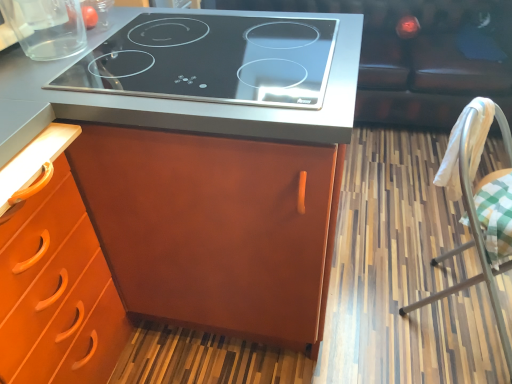
What do you see at coordinates (179, 100) in the screenshot? I see `black glass cooktop at upper center` at bounding box center [179, 100].

Describe the element at coordinates (165, 212) in the screenshot. I see `matte wood cabinet at center` at that location.

You are a GUI agent. You are given a task and a screenshot of the screen. Output one action in this format:
    pyautogui.click(x=<x>, y=<y>)
    Task: Click on the white fabric-covered chair at right
    
    Given the screenshot: What is the action you would take?
    pyautogui.click(x=475, y=211)

You are a GUI agent. You are given a task and a screenshot of the screen. Output one action in this format:
    pyautogui.click(x=<x>, y=<y>)
    Task: Click on the transparent glass container at upper left
    The height and width of the screenshot is (384, 512).
    Given the screenshot: What is the action you would take?
    pyautogui.click(x=46, y=27)

Is leather couch at upper right positioned with its back to transparent glass container at upper left?

That's not correct — leather couch at upper right is not looking away from transparent glass container at upper left.

Can you confirm if leather couch at upper right is bigger than transparent glass container at upper left?

Correct, leather couch at upper right is larger in size than transparent glass container at upper left.

Which of these two, leather couch at upper right or transparent glass container at upper left, is wider?

leather couch at upper right.

From a real-world perspective, is leather couch at upper right physically above transparent glass container at upper left?

No, from a real-world perspective, leather couch at upper right is not on top of transparent glass container at upper left.

Is white fabric-covered chair at right with matte wood cabinet at center?

No.

In the scene shown: Does white fabric-covered chair at right turn towards matte wood cabinet at center?

No, white fabric-covered chair at right does not turn towards matte wood cabinet at center.

Considering the relative sizes of white fabric-covered chair at right and matte wood cabinet at center in the image provided, is white fabric-covered chair at right bigger than matte wood cabinet at center?

No, white fabric-covered chair at right is not bigger than matte wood cabinet at center.

From a real-world perspective, is white fabric-covered chair at right located higher than matte wood cabinet at center?

Actually, white fabric-covered chair at right is physically below matte wood cabinet at center in the real world.

Which of these two, transparent glass container at upper left or black glass cooktop at upper center, stands shorter?

black glass cooktop at upper center is shorter.

Is transparent glass container at upper left in contact with black glass cooktop at upper center?

There is a gap between transparent glass container at upper left and black glass cooktop at upper center.

Is transparent glass container at upper left bigger or smaller than black glass cooktop at upper center?

transparent glass container at upper left is smaller than black glass cooktop at upper center.

Based on the photo, in the image, is matte wood cabinet at center on the left side or the right side of transparent glass container at upper left?

matte wood cabinet at center is to the right of transparent glass container at upper left.

From a real-world perspective, is matte wood cabinet at center on transparent glass container at upper left?

No, from a real-world perspective, matte wood cabinet at center is not on top of transparent glass container at upper left.

From the image's perspective, relative to transparent glass container at upper left, is matte wood cabinet at center above or below?

From the image's perspective, matte wood cabinet at center appears below transparent glass container at upper left.

How different are the orientations of matte wood cabinet at center and transparent glass container at upper left in degrees?

The facing directions of matte wood cabinet at center and transparent glass container at upper left are 89.4 degrees apart.

Is point (508, 341) positioned after point (447, 103)?

No, (508, 341) is closer to viewer.

In terms of size, does white fabric-covered chair at right appear bigger or smaller than leather couch at upper right?

white fabric-covered chair at right is smaller than leather couch at upper right.

Considering the sizes of objects white fabric-covered chair at right and leather couch at upper right in the image provided, who is wider, white fabric-covered chair at right or leather couch at upper right?

leather couch at upper right is wider.

Does point (207, 121) lie in front of point (73, 22)?

Yes, point (207, 121) is closer to viewer.

Is black glass cooktop at upper center inside the boundaries of transparent glass container at upper left, or outside?

black glass cooktop at upper center cannot be found inside transparent glass container at upper left.

Considering the sizes of objects black glass cooktop at upper center and transparent glass container at upper left in the image provided, who is shorter, black glass cooktop at upper center or transparent glass container at upper left?

Standing shorter between the two is black glass cooktop at upper center.

From the image's perspective, would you say black glass cooktop at upper center is shown under transparent glass container at upper left?

Yes.

In the scene shown: From the image's perspective, is black glass cooktop at upper center beneath matte wood cabinet at center?

Actually, black glass cooktop at upper center appears above matte wood cabinet at center in the image.

Would you say black glass cooktop at upper center is a long distance from matte wood cabinet at center?

That's not correct — black glass cooktop at upper center is a little close to matte wood cabinet at center.

Is matte wood cabinet at center at the back of black glass cooktop at upper center?

Yes, black glass cooktop at upper center's orientation is away from matte wood cabinet at center.

Can you confirm if black glass cooktop at upper center is wider than matte wood cabinet at center?

Incorrect, the width of black glass cooktop at upper center does not surpass that of matte wood cabinet at center.

You are a GUI agent. You are given a task and a screenshot of the screen. Output one action in this format:
    pyautogui.click(x=<x>, y=<y>)
    Task: Click on the couch lying on the right of transparent glass container at upper left
    
    Given the screenshot: What is the action you would take?
    pyautogui.click(x=419, y=56)

You are a GUI agent. You are given a task and a screenshot of the screen. Output one action in this format:
    pyautogui.click(x=<x>, y=<y>)
    Task: Click on the chair behind the matte wood cabinet at center
    
    Given the screenshot: What is the action you would take?
    pyautogui.click(x=475, y=211)

Which object lies nearer to the anchor point matte wood cabinet at center, transparent glass container at upper left or black glass cooktop at upper center?

The object closer to matte wood cabinet at center is black glass cooktop at upper center.

Considering their positions, is white fabric-covered chair at right positioned further to leather couch at upper right than transparent glass container at upper left?

transparent glass container at upper left lies further to leather couch at upper right than the other object.

Based on their spatial positions, is matte wood cabinet at center or transparent glass container at upper left further from white fabric-covered chair at right?

Among the two, transparent glass container at upper left is located further to white fabric-covered chair at right.

From the image, which object appears to be farther from black glass cooktop at upper center, transparent glass container at upper left or leather couch at upper right?

leather couch at upper right is positioned further to the anchor black glass cooktop at upper center.

Based on the photo, estimate the real-world distances between objects in this image. Which object is closer to black glass cooktop at upper center, transparent glass container at upper left or matte wood cabinet at center?

transparent glass container at upper left lies closer to black glass cooktop at upper center than the other object.

Which object lies further to the anchor point matte wood cabinet at center, white fabric-covered chair at right or transparent glass container at upper left?

white fabric-covered chair at right is further to matte wood cabinet at center.

Which object lies further to the anchor point transparent glass container at upper left, white fabric-covered chair at right or black glass cooktop at upper center?

Based on the image, white fabric-covered chair at right appears to be further to transparent glass container at upper left.

Estimate the real-world distances between objects in this image. Which object is further from black glass cooktop at upper center, leather couch at upper right or matte wood cabinet at center?

leather couch at upper right is further to black glass cooktop at upper center.

What are the coordinates of `countertop between transparent glass container at upper left and matte wood cabinet at center in the vertical direction` in the screenshot? It's located at click(x=179, y=100).

Where is `chair located between matte wood cabinet at center and leather couch at upper right in the depth direction`? The height and width of the screenshot is (384, 512). chair located between matte wood cabinet at center and leather couch at upper right in the depth direction is located at coordinates (475, 211).

You are a GUI agent. You are given a task and a screenshot of the screen. Output one action in this format:
    pyautogui.click(x=<x>, y=<y>)
    Task: Click on the couch between transparent glass container at upper left and white fabric-covered chair at right from left to right
    This screenshot has width=512, height=384.
    Given the screenshot: What is the action you would take?
    pyautogui.click(x=419, y=56)

At what (x,y) coordinates should I click in order to perform the action: click on countertop between transparent glass container at upper left and leather couch at upper right. Please return your answer as a coordinate pair (x, y). The width and height of the screenshot is (512, 384). Looking at the image, I should click on coord(179,100).